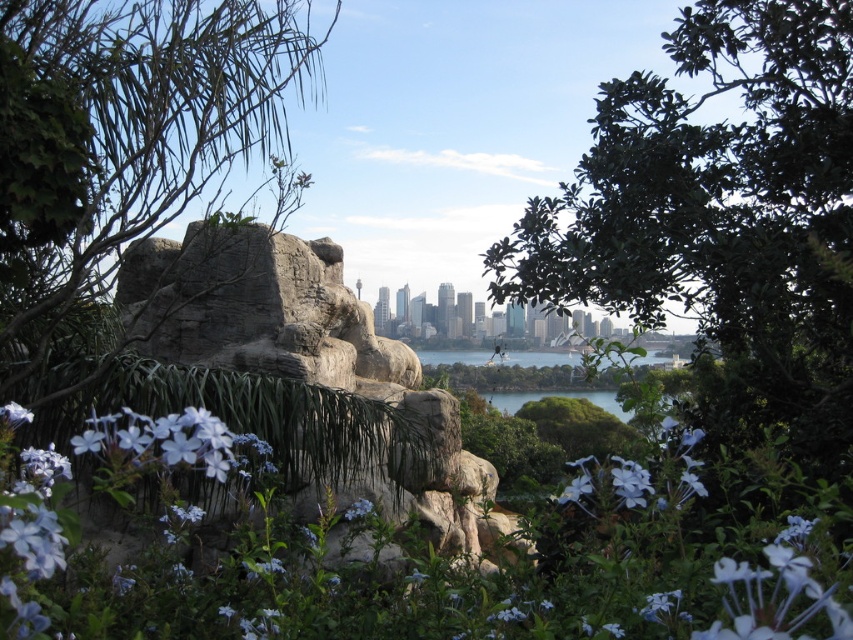
Can you confirm if green leafy tree at center is smaller than clear blue water at center?

No.

Is green leafy tree at center to the right of clear blue water at center from the viewer's perspective?

Yes, green leafy tree at center is to the right of clear blue water at center.

Which is behind, point (769, 285) or point (485, 355)?

Point (485, 355)

This screenshot has height=640, width=853. Find the location of `green leafy tree at center`. green leafy tree at center is located at coordinates (721, 220).

You are a GUI agent. You are given a task and a screenshot of the screen. Output one action in this format:
    pyautogui.click(x=<x>, y=<y>)
    Task: Click on the clear blue water at center
    The image size is (853, 640).
    Given the screenshot: What is the action you would take?
    pyautogui.click(x=540, y=356)

Describe the element at coordinates (540, 356) in the screenshot. The width and height of the screenshot is (853, 640). I see `clear blue water at center` at that location.

Where is `clear blue water at center`? clear blue water at center is located at coordinates (540, 356).

In the scene shown: Can you confirm if green liquid water at center is wider than matte white flower at lower left?

Yes.

Does point (630, 417) come closer to viewer compared to point (16, 420)?

No, (630, 417) is further to viewer.

Between point (512, 394) and point (27, 420), which one is positioned behind?

Positioned behind is point (512, 394).

You are a GUI agent. You are given a task and a screenshot of the screen. Output one action in this format:
    pyautogui.click(x=<x>, y=<y>)
    Task: Click on the green liquid water at center
    This screenshot has height=640, width=853.
    Given the screenshot: What is the action you would take?
    pyautogui.click(x=560, y=396)